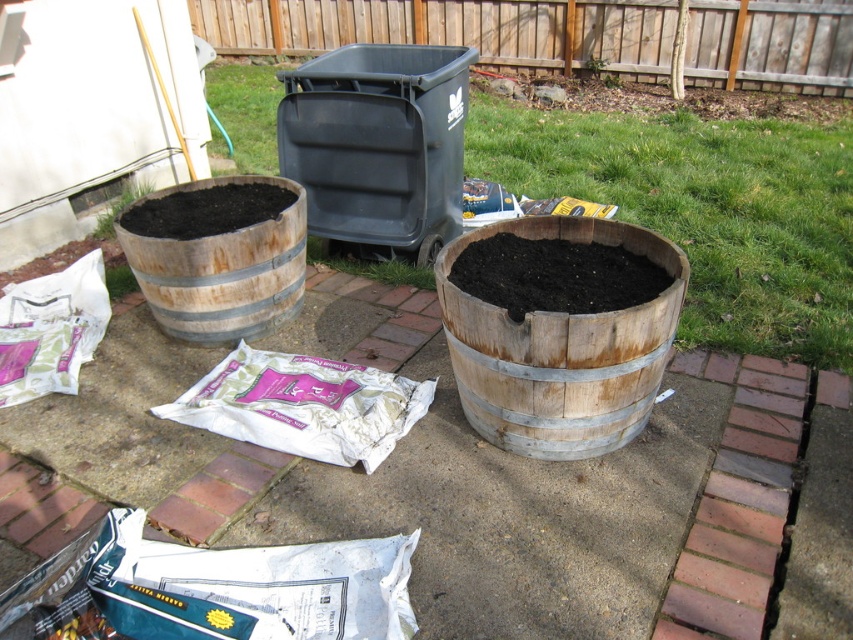
Question: Considering the relative positions of brown wooden barrel at left and green matte plant at left in the image provided, where is brown wooden barrel at left located with respect to green matte plant at left?

Choices:
 (A) left
 (B) right

Answer: (A)

Question: Can you confirm if wooden barrel at center is smaller than brown wooden barrel at center?

Choices:
 (A) no
 (B) yes

Answer: (A)

Question: Which of these objects is positioned farthest from the weathered wood barrel at center?

Choices:
 (A) green leafy plant at upper center
 (B) brown wooden barrel at center

Answer: (A)

Question: Which object is the closest to the wooden barrel at center?

Choices:
 (A) brown wooden barrel at left
 (B) green matte plant at left
 (C) wooden barrel at left

Answer: (C)

Question: Can you confirm if wooden barrel at center is positioned above brown wooden barrel at left?

Choices:
 (A) no
 (B) yes

Answer: (B)

Question: Which is nearer to the wooden barrel at center?

Choices:
 (A) brown wooden barrel at left
 (B) weathered wood barrel at center
 (C) brown wooden barrel at center
 (D) green leafy plant at upper center

Answer: (B)